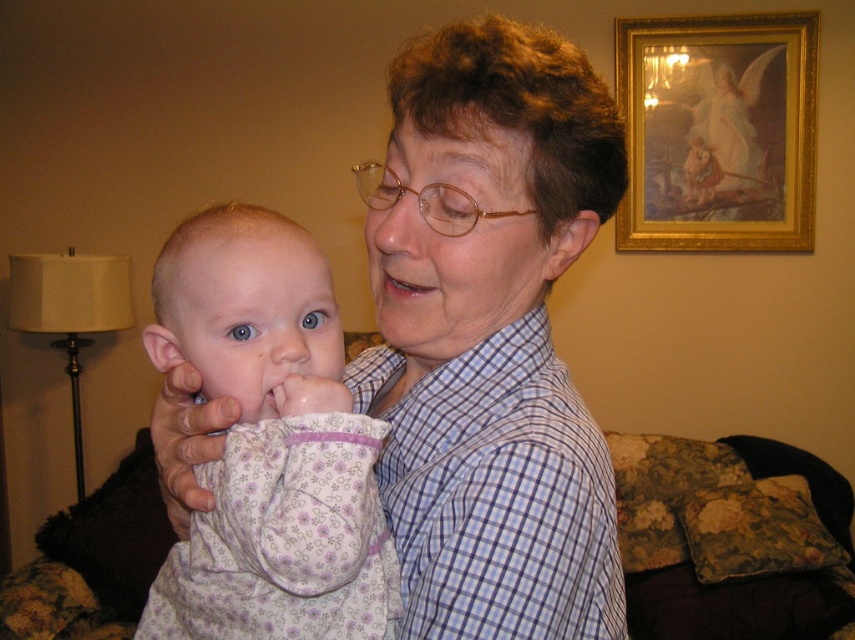
You are a photographer setting up a shoot in the living room. You have two items to place in the scene for the photo shoot. The items are the blue plaid shirt at center and the fluffy white blanket at center. The client wants the larger item to be placed on the couch. Which item should you choose?

The blue plaid shirt at center has a larger size compared to the fluffy white blanket at center, so you should place the blue plaid shirt at center on the couch.